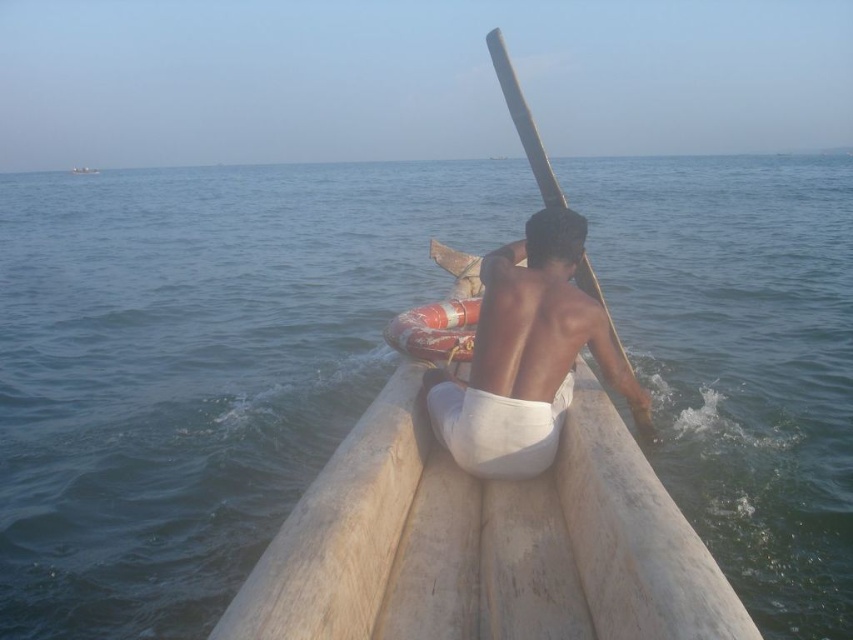
You are a sailor trying to navigate between two boats. The light brown wooden boat at center and the wooden boat at upper center are in your path. Based on their distance, which boat should you steer towards first?

The light brown wooden boat at center is closer to you than the wooden boat at upper center, so you should steer towards the light brown wooden boat at center first.

You are a passenger in the light brown wooden boat at center. You notice the smooth wooden paddle at center is needed to steer the boat. Can you reach the paddle without leaving your seat?

The light brown wooden boat at center is in front of the smooth wooden paddle at center, so the paddle is behind you. Since you are seated at the stern, you might need to lean forward to reach it, but it should be accessible without leaving your seat.

In the scene shown: You are a passenger in the wooden boat at upper center and want to reach the smooth wooden paddle at center. Which direction should you move to get it?

The smooth wooden paddle at center is in front of the wooden boat at upper center, so you should move forward to reach it.